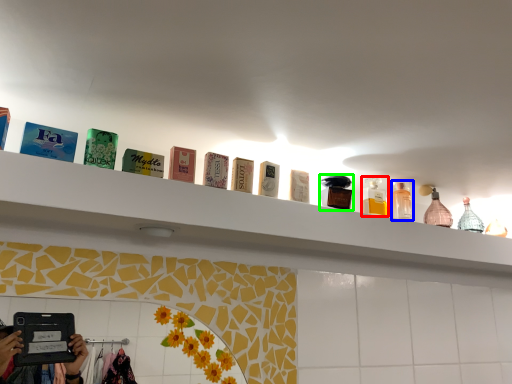
Question: Which is nearer to the mouthwash (highlighted by a red box)? toiletry (highlighted by a blue box) or toiletry (highlighted by a green box).

Choices:
 (A) toiletry
 (B) toiletry

Answer: (A)